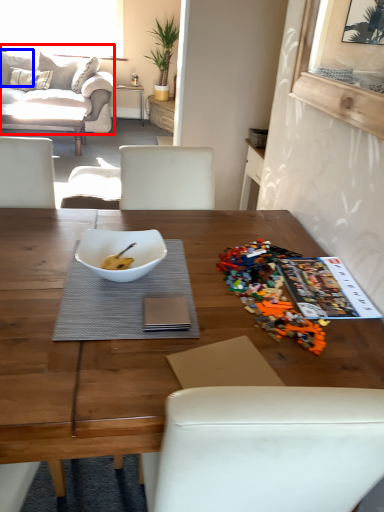
Question: Which object is further to the camera taking this photo, studio couch (highlighted by a red box) or pillow (highlighted by a blue box)?

Choices:
 (A) studio couch
 (B) pillow

Answer: (B)